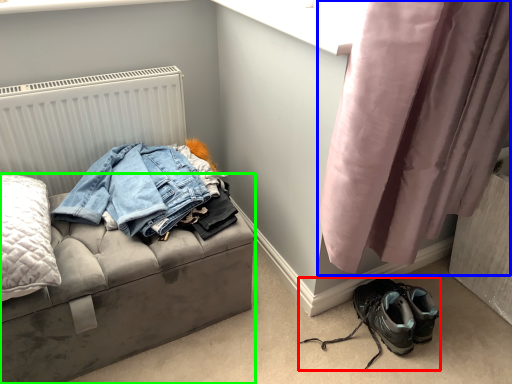
Question: Which is farther away from footwear (highlighted by a red box)? curtain (highlighted by a blue box) or furniture (highlighted by a green box)?

Choices:
 (A) curtain
 (B) furniture

Answer: (B)